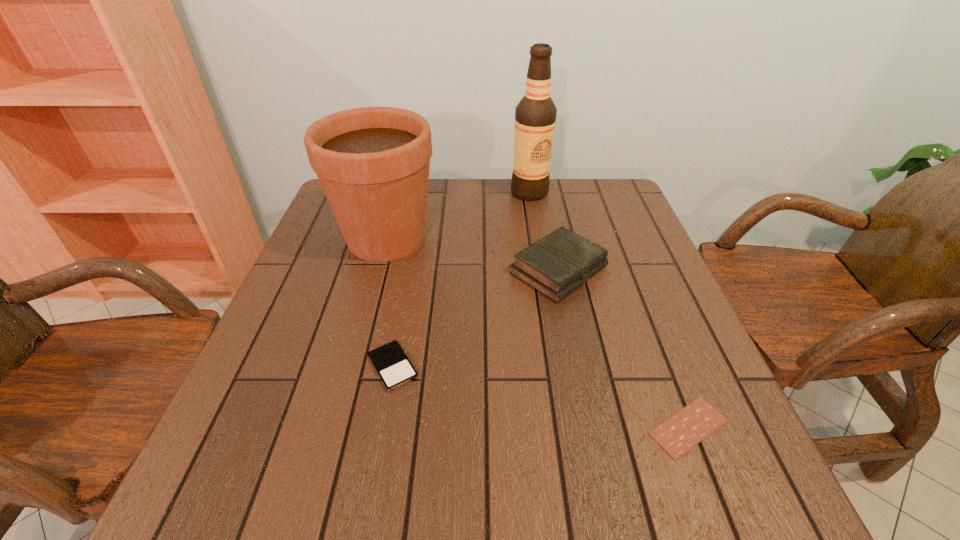
The image size is (960, 540). I want to click on the tallest object, so click(535, 115).

The height and width of the screenshot is (540, 960). What are the coordinates of `the farthest object` in the screenshot? It's located at [535, 115].

Image resolution: width=960 pixels, height=540 pixels. Identify the location of flowerpot. (373, 163).

The height and width of the screenshot is (540, 960). What are the coordinates of `the third shortest object` in the screenshot? It's located at (557, 264).

The width and height of the screenshot is (960, 540). In order to click on the second shortest object in this screenshot , I will do `click(392, 365)`.

At what (x,y) coordinates should I click in order to perform the action: click on the second nearest object. Please return your answer as a coordinate pair (x, y). Looking at the image, I should click on (392, 365).

Where is `chocolate bar`? chocolate bar is located at coordinates (686, 428).

You are a GUI agent. You are given a task and a screenshot of the screen. Output one action in this format:
    pyautogui.click(x=<x>, y=<y>)
    Task: Click on the nearest object
    The width and height of the screenshot is (960, 540).
    Given the screenshot: What is the action you would take?
    pyautogui.click(x=686, y=428)

What are the coordinates of `free region located on the label of the farthest object` in the screenshot? It's located at (537, 236).

Find the location of `vacant region located on the back of the fourth shortest object`. vacant region located on the back of the fourth shortest object is located at coordinates (398, 192).